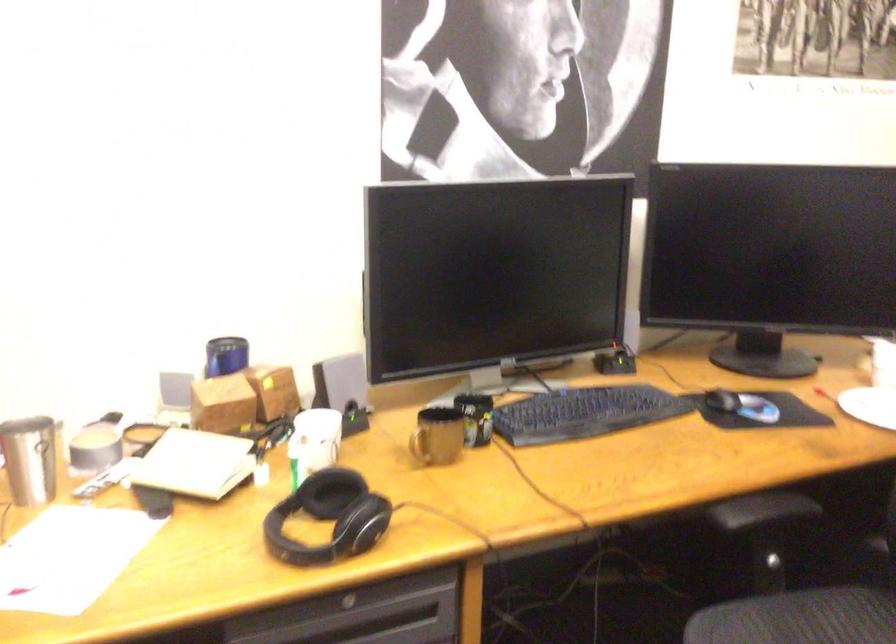
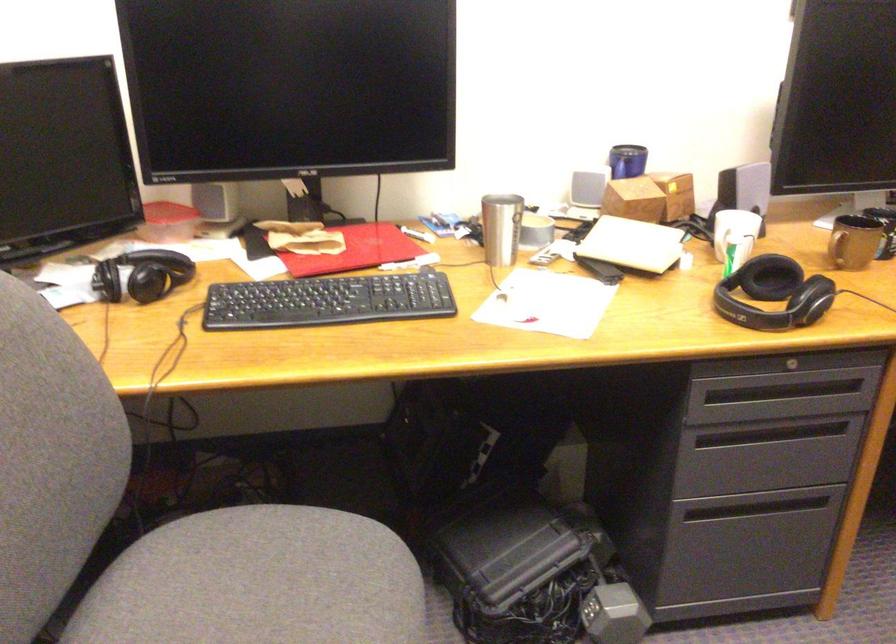
Find the pixel in the second image that matches the point at 362,532 in the first image.

(810, 299)